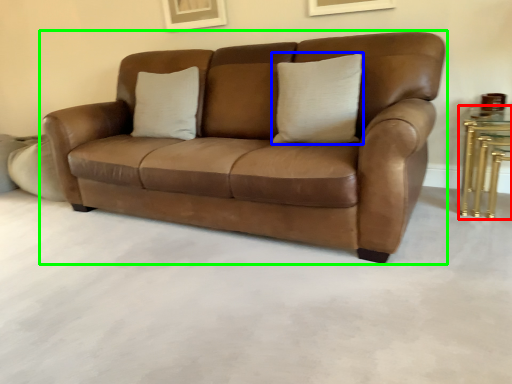
Question: Which is nearer to the table (highlighted by a red box)? pillow (highlighted by a blue box) or studio couch (highlighted by a green box).

Choices:
 (A) pillow
 (B) studio couch

Answer: (A)